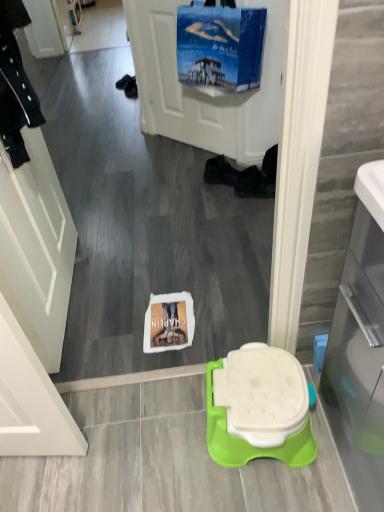
Locate an element on the screen. The image size is (384, 512). free space in front of blue fabric screen door at upper center, arranged as the first screen door when viewed from the back is located at coordinates (173, 173).